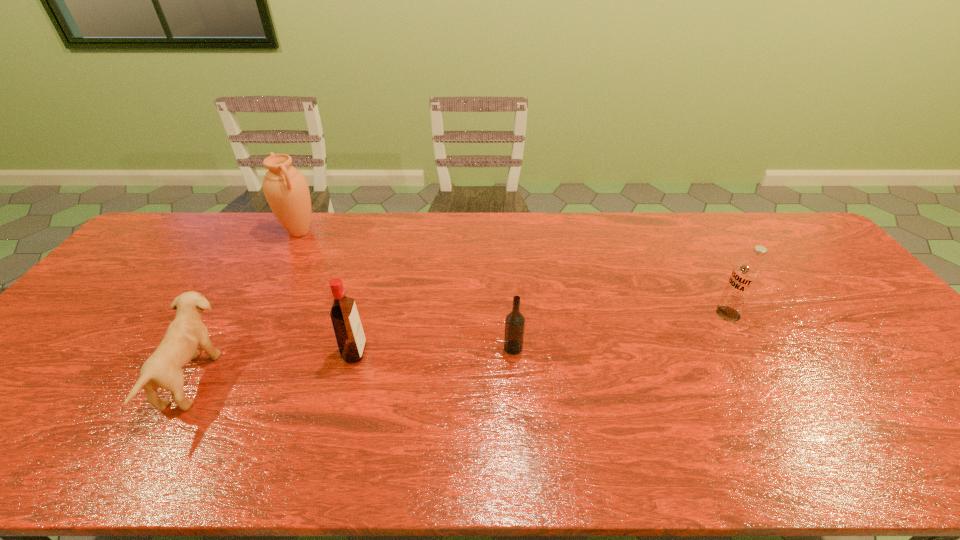
Locate an element on the screen. The width and height of the screenshot is (960, 540). free region located on the front label of the rightmost object is located at coordinates (586, 314).

This screenshot has height=540, width=960. I want to click on free space located 0.240m on the front label of the rightmost object, so click(629, 314).

In order to click on free space located 0.310m on the right of the shortest vodka in this screenshot , I will do `click(643, 348)`.

Where is `vacant area situated on the left side of the puppy`? The height and width of the screenshot is (540, 960). vacant area situated on the left side of the puppy is located at coordinates (286, 379).

Find the location of a particular element. object that is at the far edge is located at coordinates (286, 190).

I want to click on object located at the near edge, so click(x=186, y=332).

You are a GUI agent. You are given a task and a screenshot of the screen. Output one action in this format:
    pyautogui.click(x=<x>, y=<y>)
    Task: Click on the free space at the far edge of the desktop
    The height and width of the screenshot is (540, 960).
    Given the screenshot: What is the action you would take?
    pyautogui.click(x=381, y=249)

Locate an element on the screen. This screenshot has height=540, width=960. free space at the near edge of the desktop is located at coordinates (x=451, y=449).

Identify the location of vacant space at the left edge of the desktop. This screenshot has height=540, width=960. (2, 406).

Locate an element on the screen. The height and width of the screenshot is (540, 960). free space at the right edge of the desktop is located at coordinates (804, 278).